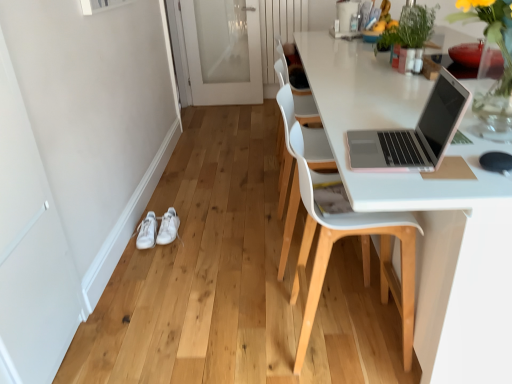
Question: In terms of size, does green leafy plant at upper right appear bigger or smaller than white plastic chair at right, which is the 2th chair from back to front?

Choices:
 (A) small
 (B) big

Answer: (A)

Question: Is green leafy plant at upper right taller or shorter than white plastic chair at right, which is the 1th chair in front-to-back order?

Choices:
 (A) tall
 (B) short

Answer: (B)

Question: Considering the real-world distances, which object is closest to the white glossy screen door at lower left, which ranks as the 1th screen door in front-to-back order?

Choices:
 (A) white plastic chair at center, the 1th chair viewed from the back
 (B) white plastic chair at right, which is the 2th chair from back to front
 (C) green leafy plant at upper right
 (D) white frosted glass screen door at center, the 2th screen door in the front-to-back sequence
 (E) white leather sneakers at lower left, the 1th footwear from the left

Answer: (E)

Question: Based on their relative distances, which object is farther from the white frosted glass screen door at center, the 2th screen door in the front-to-back sequence?

Choices:
 (A) white plastic chair at right, which is the 2th chair from back to front
 (B) white leather sneakers at lower left, the second footwear in the right-to-left sequence
 (C) white plastic chair at center, the 1th chair viewed from the back
 (D) green leafy plant at upper right
 (E) white leather sneakers at lower left, the second footwear when ordered from left to right

Answer: (A)